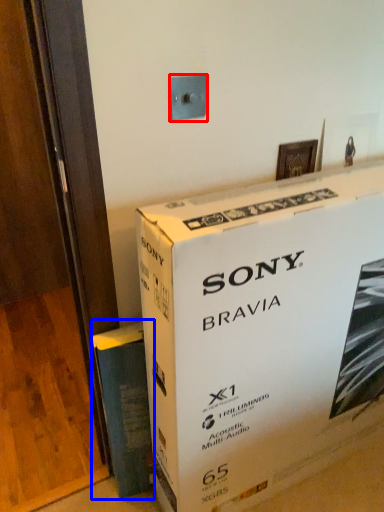
Question: Which object appears closest to the camera in this image, electric outlet (highlighted by a red box) or paperback book (highlighted by a blue box)?

Choices:
 (A) electric outlet
 (B) paperback book

Answer: (A)